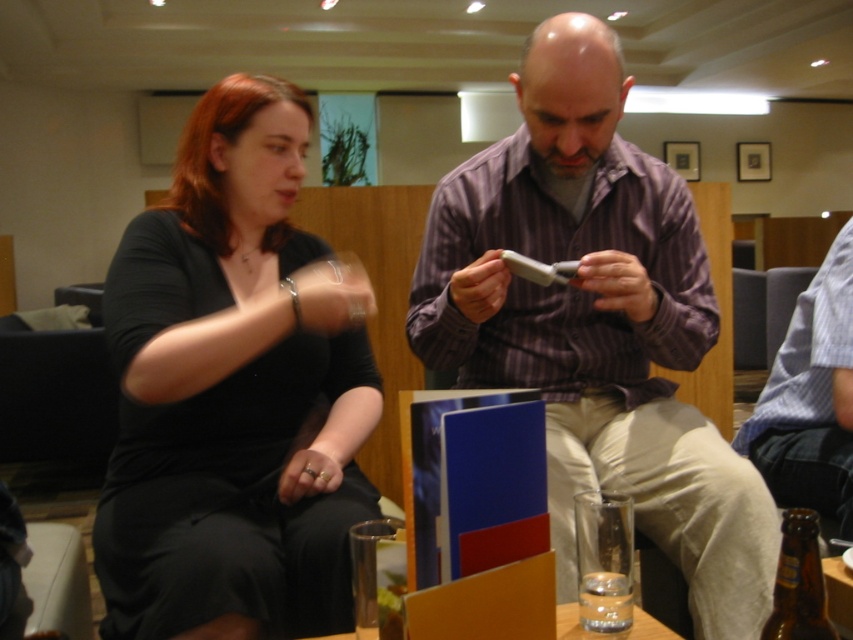
Question: Among these points, which one is farthest from the camera?

Choices:
 (A) (780, 595)
 (B) (175, 300)
 (C) (782, 358)

Answer: (C)

Question: Does blue striped shirt at upper right appear under brown glass bottle at lower right?

Choices:
 (A) no
 (B) yes

Answer: (A)

Question: Which point is closer to the camera?

Choices:
 (A) black matte shirt at upper left
 (B) blue striped shirt at upper right
 (C) brown glass bottle at lower right
 (D) matte purple shirt at center

Answer: (C)

Question: Which object is the farthest from the black matte shirt at upper left?

Choices:
 (A) matte purple shirt at center
 (B) brown glass bottle at lower right
 (C) blue striped shirt at upper right

Answer: (C)

Question: Is black matte shirt at upper left positioned in front of matte purple shirt at center?

Choices:
 (A) yes
 (B) no

Answer: (A)

Question: Is black matte shirt at upper left below matte purple shirt at center?

Choices:
 (A) no
 (B) yes

Answer: (A)